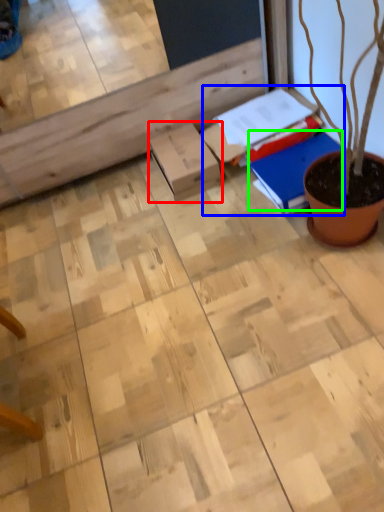
Question: Which object is positioned closest to cardboard box (highlighted by a red box)? Select from book (highlighted by a blue box) and notebook (highlighted by a green box).

Choices:
 (A) book
 (B) notebook

Answer: (A)